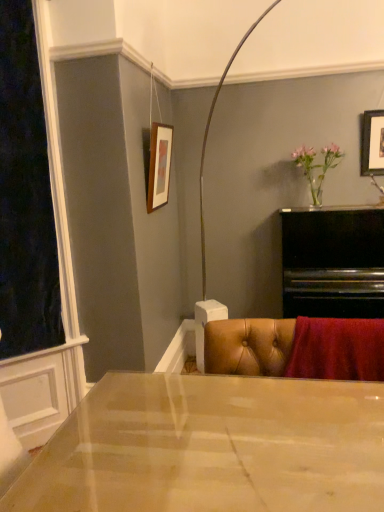
Question: Considering the positions of point (379, 122) and point (34, 125), is point (379, 122) closer or farther from the camera than point (34, 125)?

Choices:
 (A) closer
 (B) farther

Answer: (B)

Question: In terms of width, does wooden picture frame at upper right, which ranks as the second picture frame in left-to-right order, look wider or thinner when compared to velvet dark at left?

Choices:
 (A) thin
 (B) wide

Answer: (A)

Question: Which of these objects is positioned farthest from the matte wooden picture frame at upper center, the second picture frame in the right-to-left sequence?

Choices:
 (A) pink glass vase at upper right
 (B) velvet dark at left
 (C) wooden picture frame at upper right, positioned as the 1th picture frame in right-to-left order

Answer: (C)

Question: Considering the real-world distances, which object is closest to the matte wooden picture frame at upper center, the first picture frame from the left?

Choices:
 (A) velvet dark at left
 (B) pink glass vase at upper right
 (C) wooden picture frame at upper right, positioned as the 1th picture frame in right-to-left order

Answer: (A)